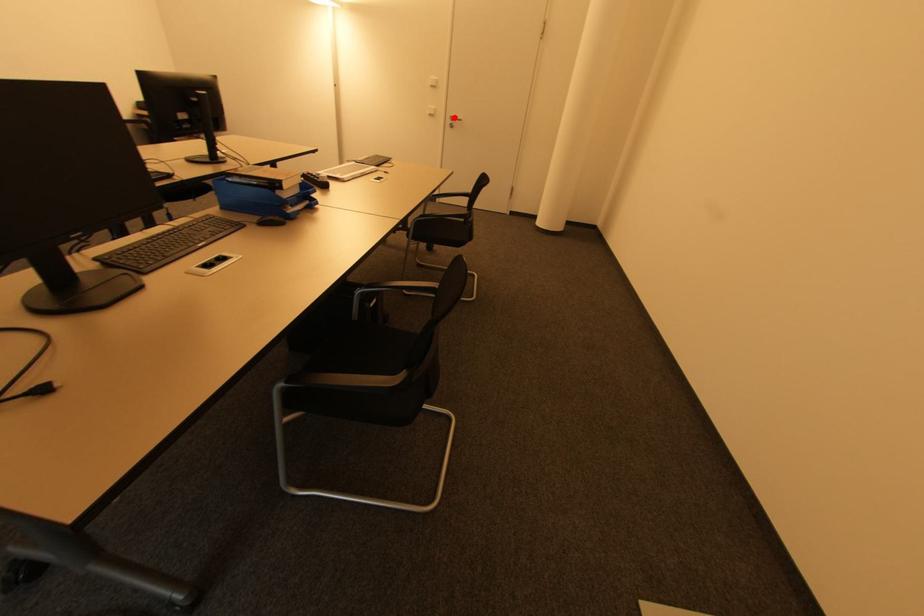
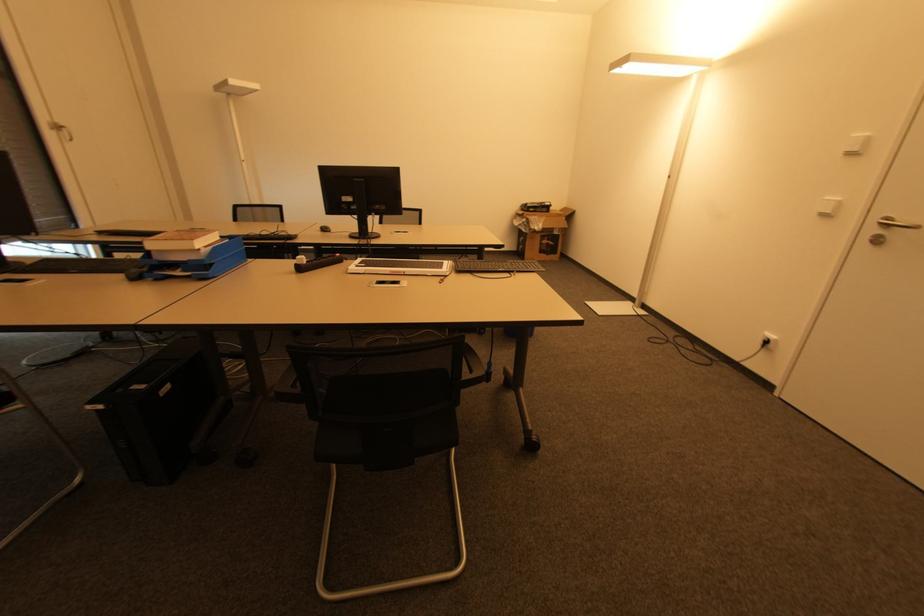
In the second image, find the point that corresponds to the highlighted location in the first image.

(890, 221)